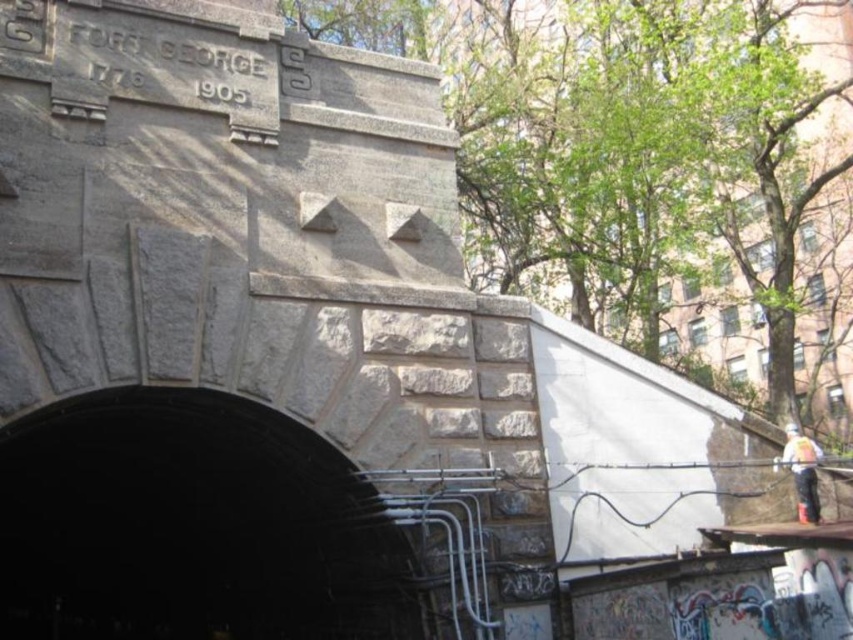
Question: Among these objects, which one is nearest to the camera?

Choices:
 (A) white plastic bag at right
 (B) dark gray stone tunnel at center

Answer: (B)

Question: Among these points, which one is nearest to the camera?

Choices:
 (A) (790, 436)
 (B) (134, 588)

Answer: (A)

Question: Can you confirm if dark gray stone tunnel at center is positioned above white plastic bag at right?

Choices:
 (A) no
 (B) yes

Answer: (A)

Question: Is dark gray stone tunnel at center above white plastic bag at right?

Choices:
 (A) no
 (B) yes

Answer: (A)

Question: Can you confirm if dark gray stone tunnel at center is thinner than white plastic bag at right?

Choices:
 (A) yes
 (B) no

Answer: (B)

Question: Which point is farther from the camera taking this photo?

Choices:
 (A) (231, 404)
 (B) (799, 493)

Answer: (B)